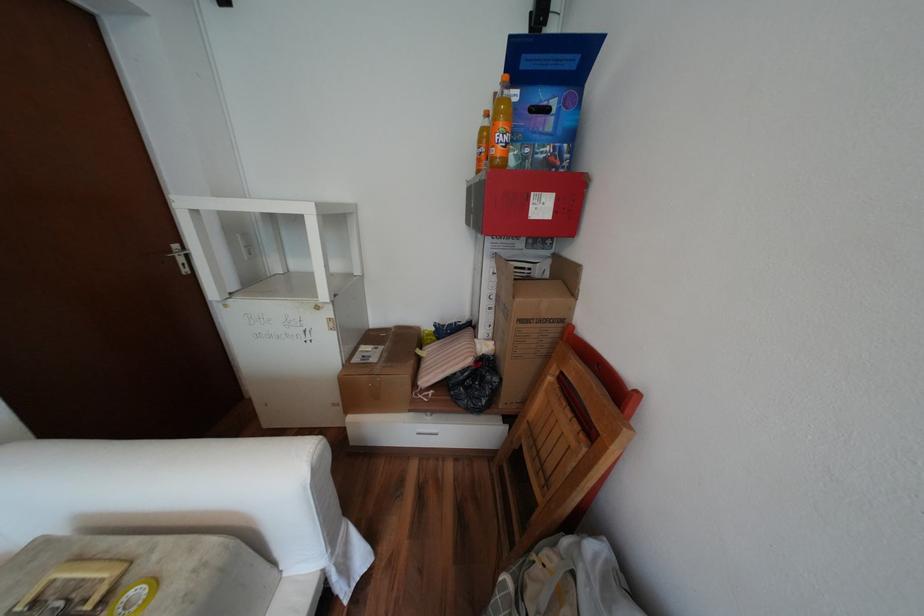
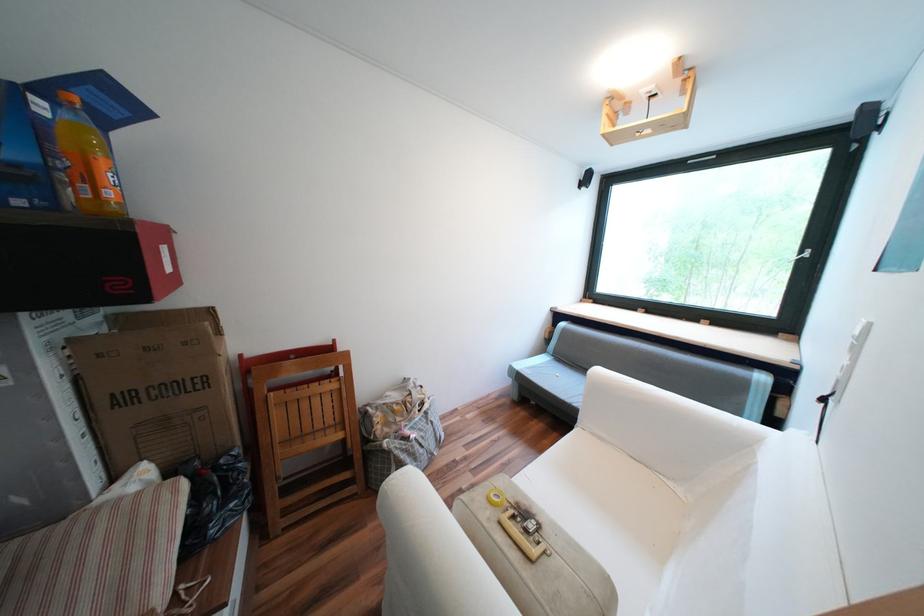
Locate, in the second image, the point that corresponds to point (579, 415) in the first image.

(325, 383)